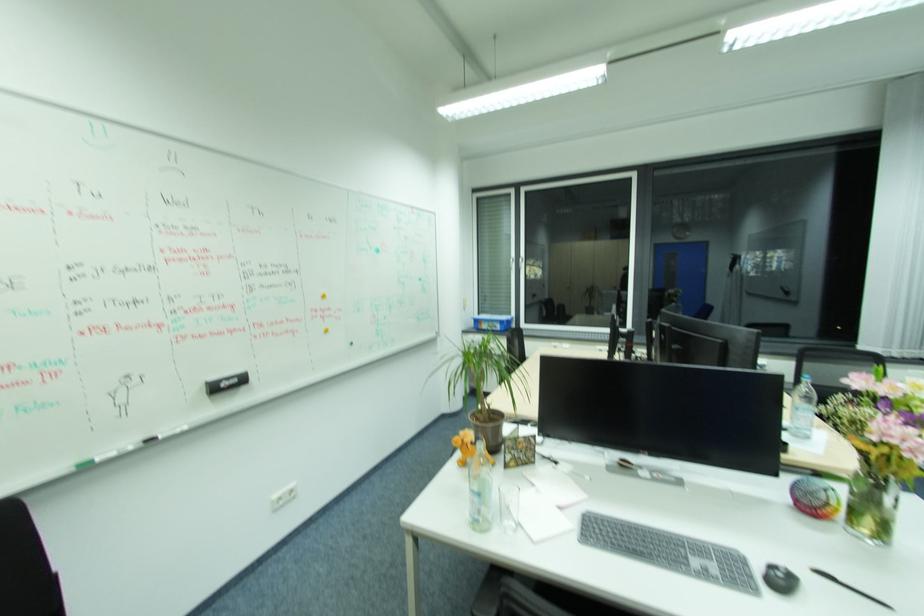
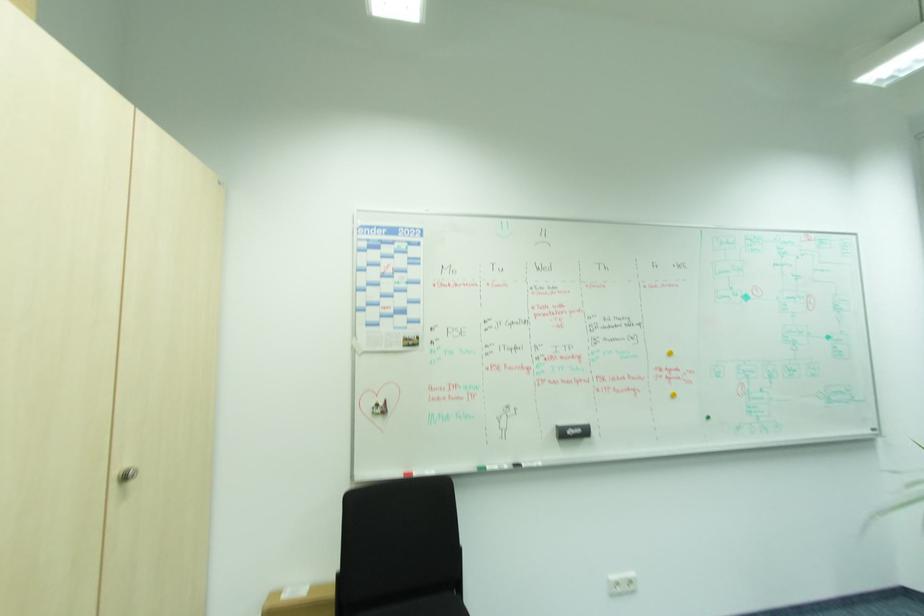
The point at (166, 438) is marked in the first image. Where is the corresponding point in the second image?

(528, 464)